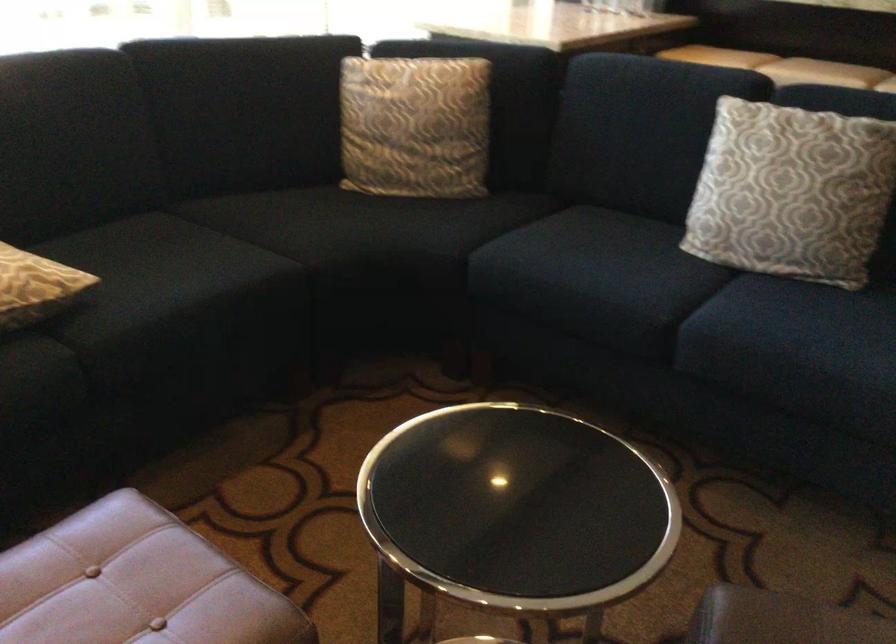
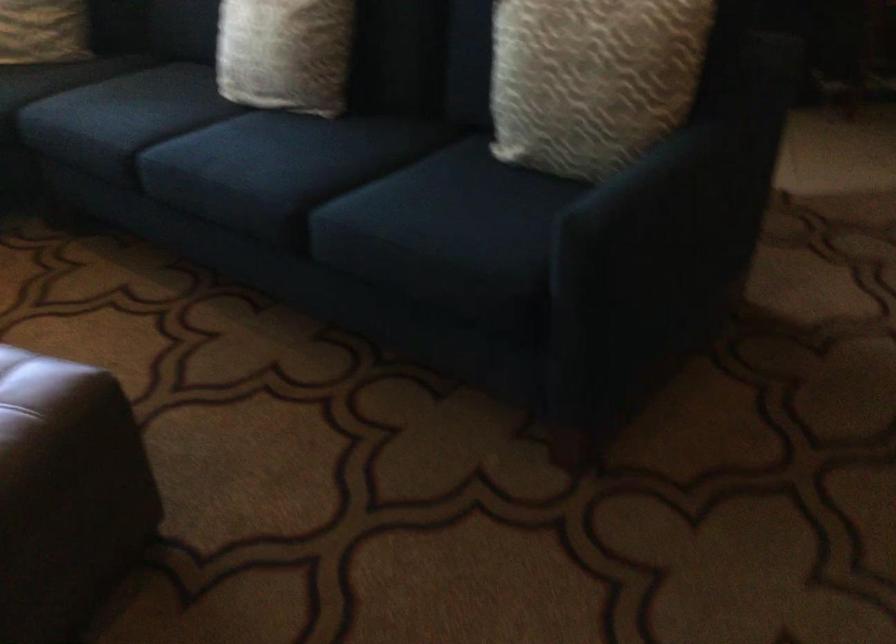
In the second image, find the point that corresponds to the point at 819,225 in the first image.

(285, 53)